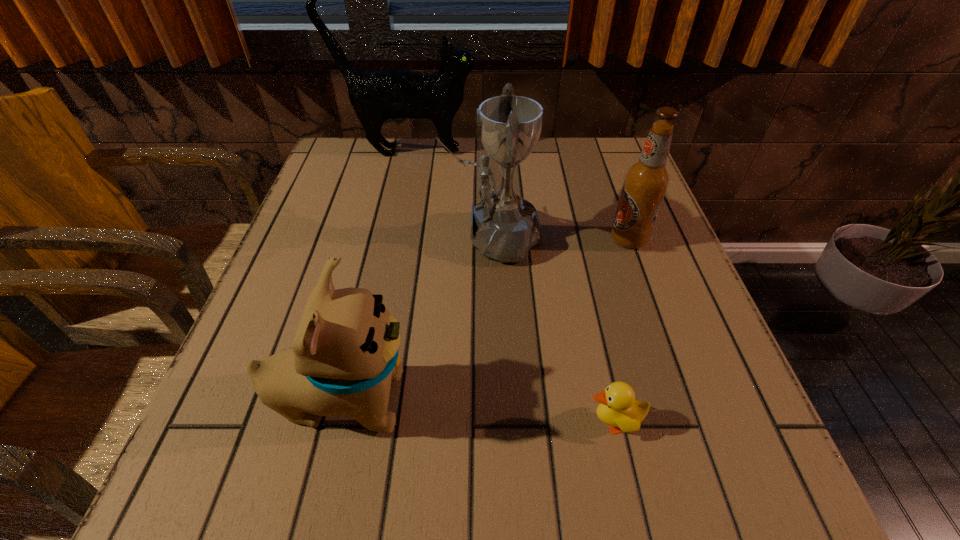
This screenshot has width=960, height=540. In order to click on cat in this screenshot , I will do `click(376, 95)`.

This screenshot has height=540, width=960. Identify the location of the farthest object. (376, 95).

The height and width of the screenshot is (540, 960). In order to click on award in this screenshot , I will do `click(504, 226)`.

Find the location of `beer bottle`. beer bottle is located at coordinates (645, 183).

At what (x,y) coordinates should I click in order to perform the action: click on puppy. Please return your answer as a coordinate pair (x, y). The height and width of the screenshot is (540, 960). Looking at the image, I should click on (344, 356).

This screenshot has width=960, height=540. What are the coordinates of `duckling` in the screenshot? It's located at point(618,408).

I want to click on the shortest object, so click(618, 408).

What are the coordinates of `blank space located 0.250m on the face of the farthest object` in the screenshot? It's located at (566, 152).

Find the location of a particular element. The height and width of the screenshot is (540, 960). vacant space located on the side with emblem of the award is located at coordinates (410, 238).

Find the location of a particular element. This screenshot has width=960, height=540. vacant space located 0.210m on the side with emblem of the award is located at coordinates (347, 238).